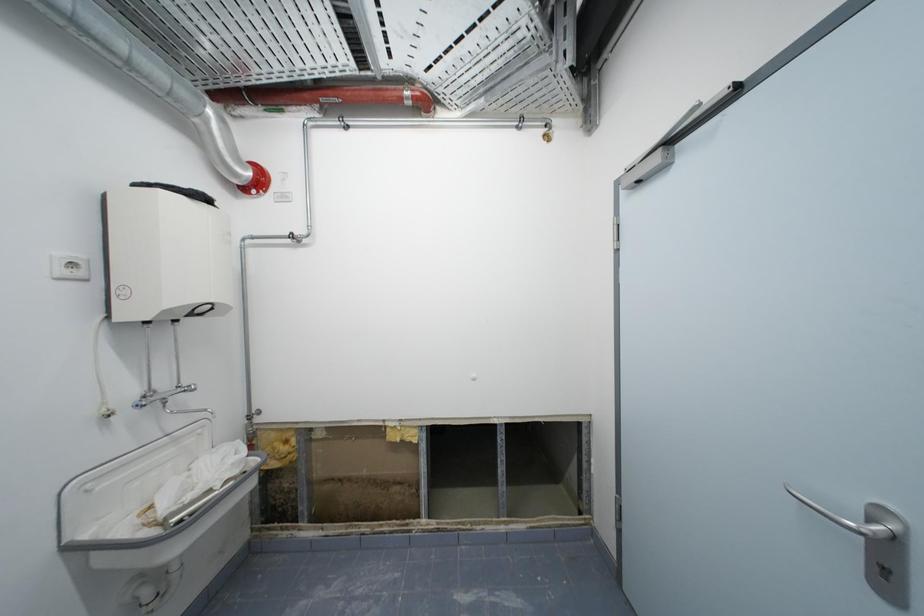
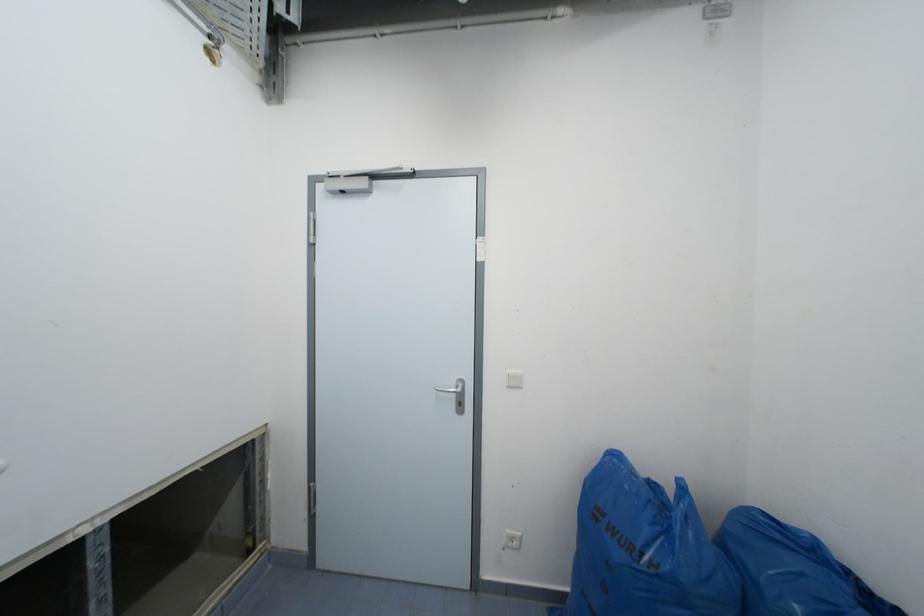
Question: The camera is either moving clockwise (left) or counter-clockwise (right) around the object. The first image is from the beginning of the video and the second image is from the end. Is the camera moving left or right when shooting the video?

Choices:
 (A) Left
 (B) Right

Answer: (A)